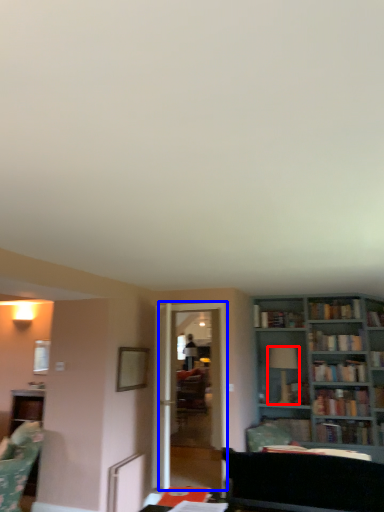
Question: Which object is closer to the camera taking this photo, fixture (highlighted by a red box) or glass door (highlighted by a blue box)?

Choices:
 (A) fixture
 (B) glass door

Answer: (B)